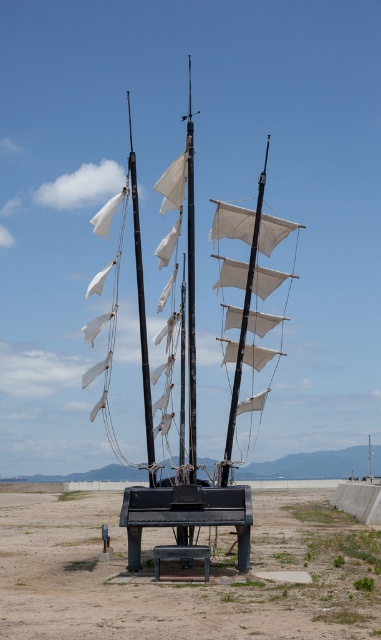
Consider the image. You are standing at the edge of the art installation and want to place a small flag at the point marked by coordinates point (182, 580). According to the scene description, where exactly should you place the flag?

The point (182, 580) is located on the dirt field at lower center, so you should place the flag on the dirt field at lower center near the central area of the installation.

You are standing at the origin point of the coordinate system, which is the bottom left corner of the image. You want to walk directly towards the metallic matte sailboat at center. Which direction should you head in?

Since the metallic matte sailboat at center is located at coordinate point 0.477 on the x axis and 0.496 on the y axis, you should head northeast to reach it.